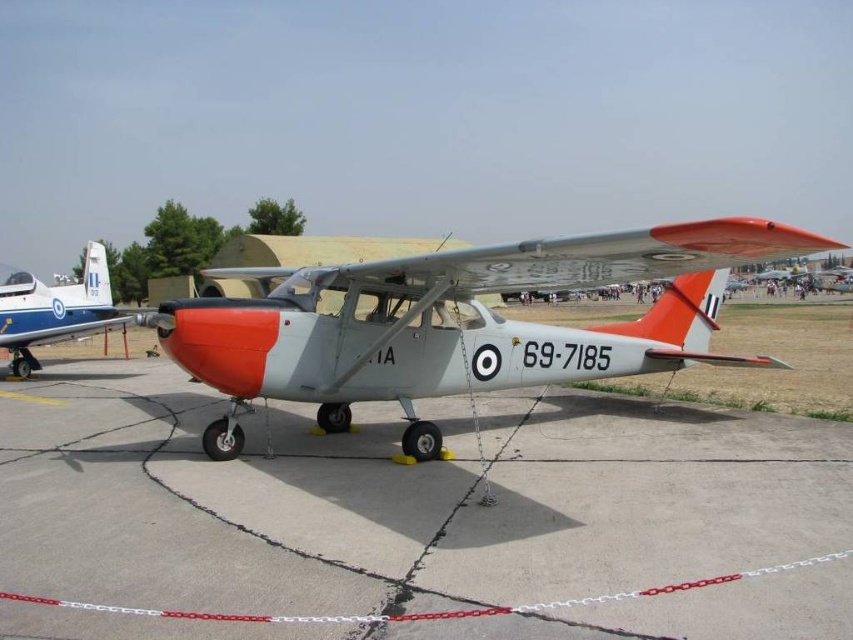
You are a pilot preparing to taxi your plane. You see the matte gray airplane at center and the matte blue airplane at left. Which airplane should you avoid taxiing behind to prevent blocking the runway?

You should avoid taxiing behind the matte gray airplane at center because it is in front of the matte blue airplane at left, so blocking the runway would be more likely if you position yourself behind it.

You are standing on the gray concrete tarmac at center and want to walk to the matte blue airplane at left. Which direction should you head?

You should head to the left because the gray concrete tarmac at center is to the right of the matte blue airplane at left according to the description.